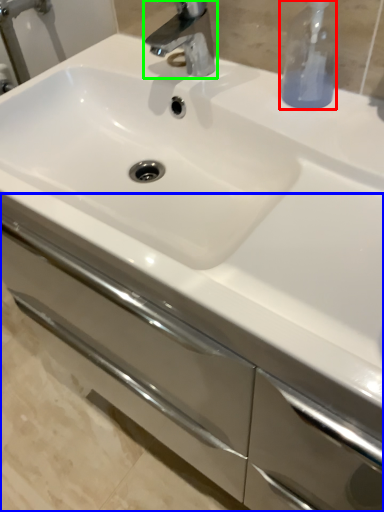
Question: Based on their relative distances, which object is nearer to soap dispenser (highlighted by a red box)? Choose from bathroom cabinet (highlighted by a blue box) and tap (highlighted by a green box).

Choices:
 (A) bathroom cabinet
 (B) tap

Answer: (B)